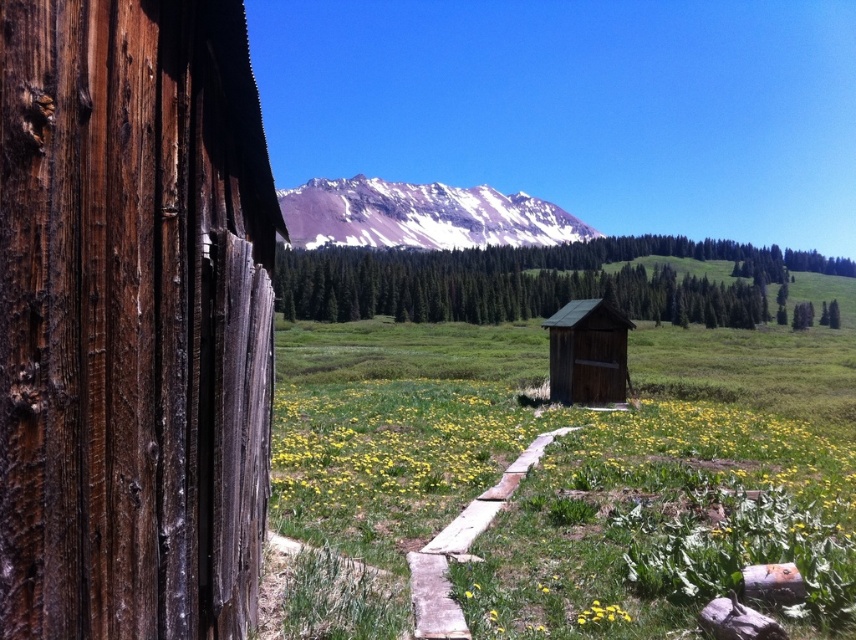
Question: Does weathered brown wood at left have a smaller size compared to yellow matte flower at lower center?

Choices:
 (A) no
 (B) yes

Answer: (A)

Question: Is weathered brown wood at left to the left of wooden plank path at center from the viewer's perspective?

Choices:
 (A) no
 (B) yes

Answer: (B)

Question: Which of these objects is positioned farthest from the wooden plank path at center?

Choices:
 (A) yellow matte flower at lower center
 (B) snowy rocky mountain at upper center
 (C) weathered brown wood at left
 (D) green wood log cabin at center

Answer: (B)

Question: Which point is farther to the camera?

Choices:
 (A) (435, 625)
 (B) (580, 618)
 (C) (626, 330)

Answer: (C)

Question: Does weathered brown wood at left appear under green wood log cabin at center?

Choices:
 (A) yes
 (B) no

Answer: (B)

Question: Which object is positioned farthest from the green wood log cabin at center?

Choices:
 (A) weathered brown wood at left
 (B) wooden plank path at center

Answer: (A)